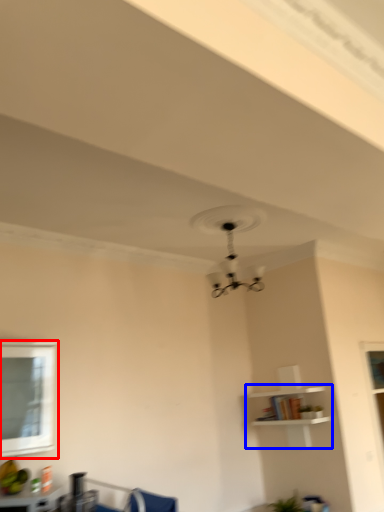
Question: Among these objects, which one is nearest to the camera, window (highlighted by a red box) or shelf (highlighted by a blue box)?

Choices:
 (A) window
 (B) shelf

Answer: (A)